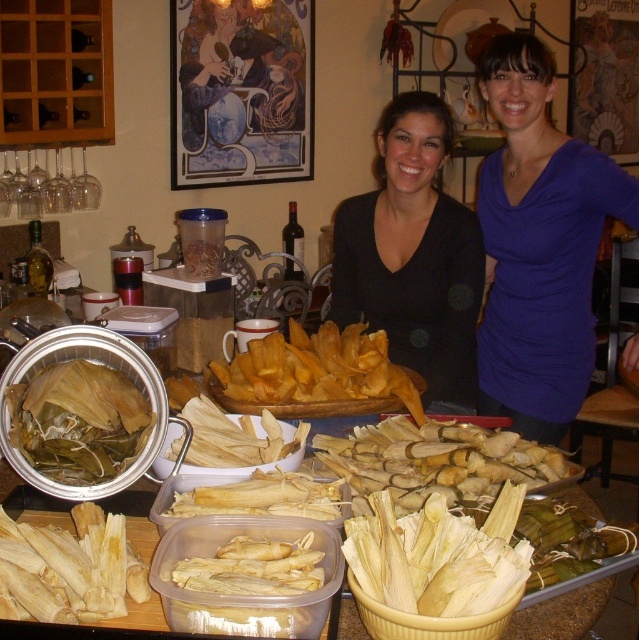
Is point (187, 509) less distant than point (1, 484)?

Yes, it is.

Is the position of white matte corn husks at center less distant than that of yellow corn husk tamales at center?

Yes, white matte corn husks at center is in front of yellow corn husk tamales at center.

Is point (178, 490) farther from camera compared to point (10, 352)?

No.

Locate an element on the screen. white matte corn husks at center is located at coordinates (263, 497).

Who is taller, white corn husk tamales at center or yellow paper tamales at lower left?

white corn husk tamales at center

Is white corn husk tamales at center in front of yellow paper tamales at lower left?

Yes, it is in front of yellow paper tamales at lower left.

Is point (351, 563) closer to camera compared to point (70, 560)?

That is True.

You are a GUI agent. You are given a task and a screenshot of the screen. Output one action in this format:
    pyautogui.click(x=<x>, y=<y>)
    Task: Click on the white corn husk tamales at center
    
    Given the screenshot: What is the action you would take?
    pyautogui.click(x=438, y=556)

Can you confirm if yellow paper wrapped tamales at center is taller than white matte corn husks at center?

Indeed, yellow paper wrapped tamales at center has a greater height compared to white matte corn husks at center.

Who is higher up, yellow paper wrapped tamales at center or white matte corn husks at center?

Positioned higher is white matte corn husks at center.

The height and width of the screenshot is (640, 639). Describe the element at coordinates (567, 541) in the screenshot. I see `yellow paper wrapped tamales at center` at that location.

Where is `yellow paper wrapped tamales at center`? The image size is (639, 640). yellow paper wrapped tamales at center is located at coordinates (567, 541).